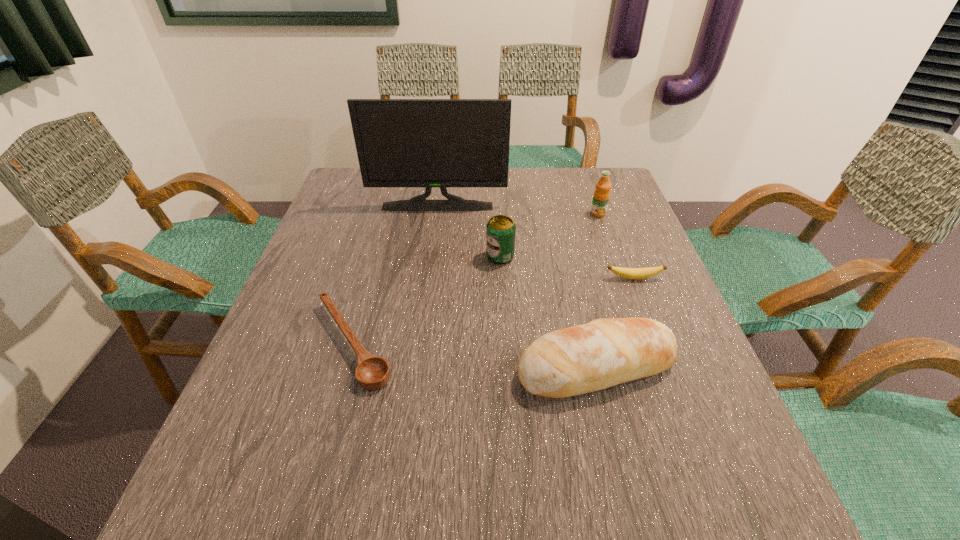
I want to click on vacant region located 0.090m on the back of the banana, so click(624, 252).

Image resolution: width=960 pixels, height=540 pixels. In order to click on vacant point located 0.240m on the back of the wooden spoon in this screenshot , I will do `click(381, 239)`.

Locate an element on the screen. The image size is (960, 540). object at the far edge is located at coordinates (428, 143).

This screenshot has height=540, width=960. I want to click on monitor that is positioned at the left edge, so click(x=428, y=143).

You are a GUI agent. You are given a task and a screenshot of the screen. Output one action in this format:
    pyautogui.click(x=<x>, y=<y>)
    Task: Click on the wooden spoon located in the left edge section of the desktop
    The width and height of the screenshot is (960, 540).
    Given the screenshot: What is the action you would take?
    pyautogui.click(x=372, y=372)

Locate an element on the screen. orange juice present at the right edge is located at coordinates (601, 196).

The image size is (960, 540). Identify the location of bread that is at the right edge. (580, 359).

Locate an element on the screen. The width and height of the screenshot is (960, 540). banana present at the right edge is located at coordinates (631, 273).

This screenshot has width=960, height=540. Find the location of `object present at the far left corner`. object present at the far left corner is located at coordinates (428, 143).

At what (x,y) coordinates should I click in order to perform the action: click on free space at the far edge of the desktop. Please return your answer as a coordinate pair (x, y). The width and height of the screenshot is (960, 540). Looking at the image, I should click on (541, 172).